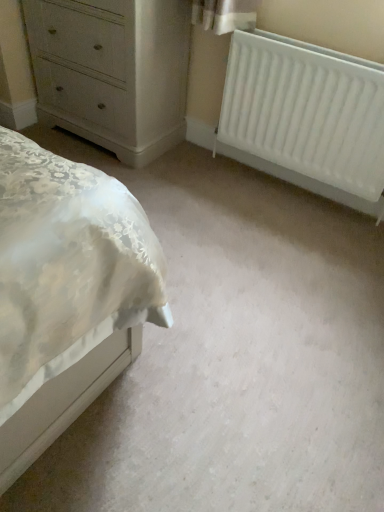
At what (x,y) coordinates should I click in order to perform the action: click on free point in front of white matte radiator at right. Please return your answer as a coordinate pair (x, y). Looking at the image, I should click on (292, 248).